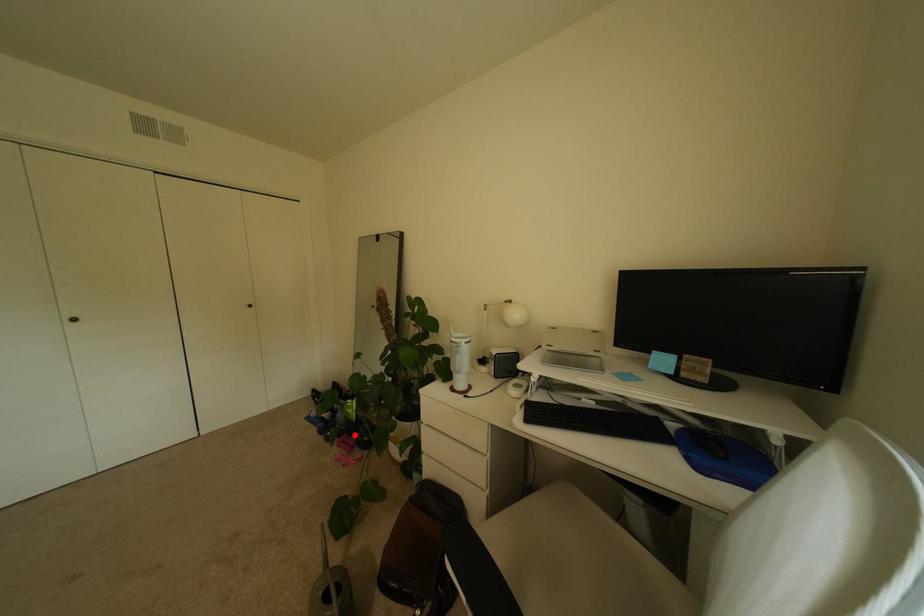
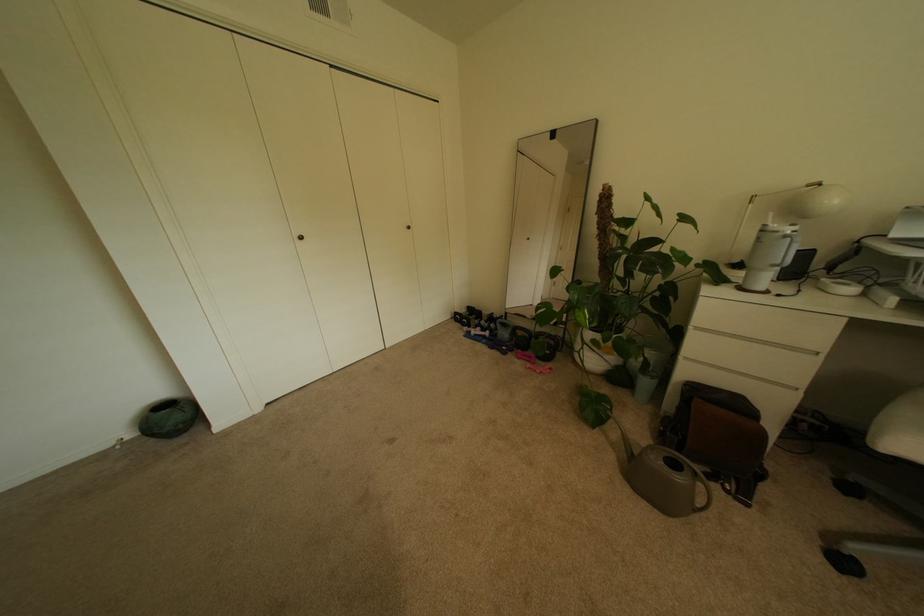
In the second image, find the point that corresponds to the highlighted location in the first image.

(524, 350)